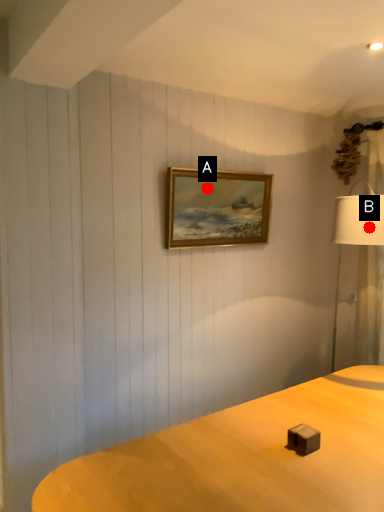
Question: Two points are circled on the image, labeled by A and B beside each circle. Which point is further to the camera?

Choices:
 (A) A is further
 (B) B is further

Answer: (A)